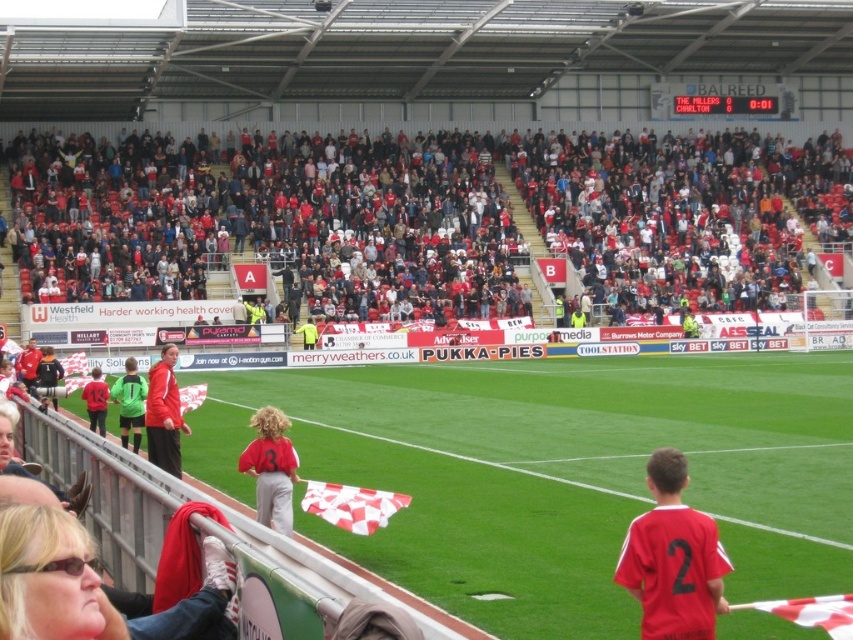
Question: Is matte black jacket at left closer to camera compared to yellow fabric at center?

Choices:
 (A) yes
 (B) no

Answer: (A)

Question: Does matte red jersey at center have a smaller size compared to matte red shirt at left?

Choices:
 (A) yes
 (B) no

Answer: (A)

Question: Which object is positioned closest to the red jersey at center?

Choices:
 (A) matte black jacket at left
 (B) matte red shirt at left
 (C) green jersey at center

Answer: (C)

Question: Which of the following is the farthest from the observer?

Choices:
 (A) red jacket at center
 (B) matte red shirt at left
 (C) green grass football field at center

Answer: (B)

Question: Estimate the real-world distances between objects in this image. Which object is farther from the matte red jersey at center?

Choices:
 (A) yellow fabric at center
 (B) matte black jacket at left
 (C) green grass football field at center

Answer: (A)

Question: Does matte red jersey at center appear over matte red shirt at left?

Choices:
 (A) no
 (B) yes

Answer: (A)